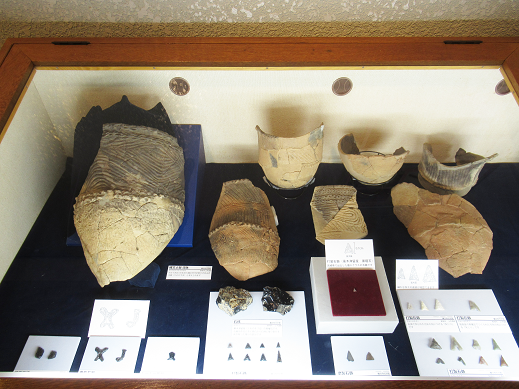
You are a GUI agent. You are given a task and a screenshot of the screen. Output one action in this format:
    pyautogui.click(x=<x>, y=<y>)
    Task: Click on the textured painted wall
    This screenshot has width=519, height=389.
    Given the screenshot: What is the action you would take?
    pyautogui.click(x=236, y=10)